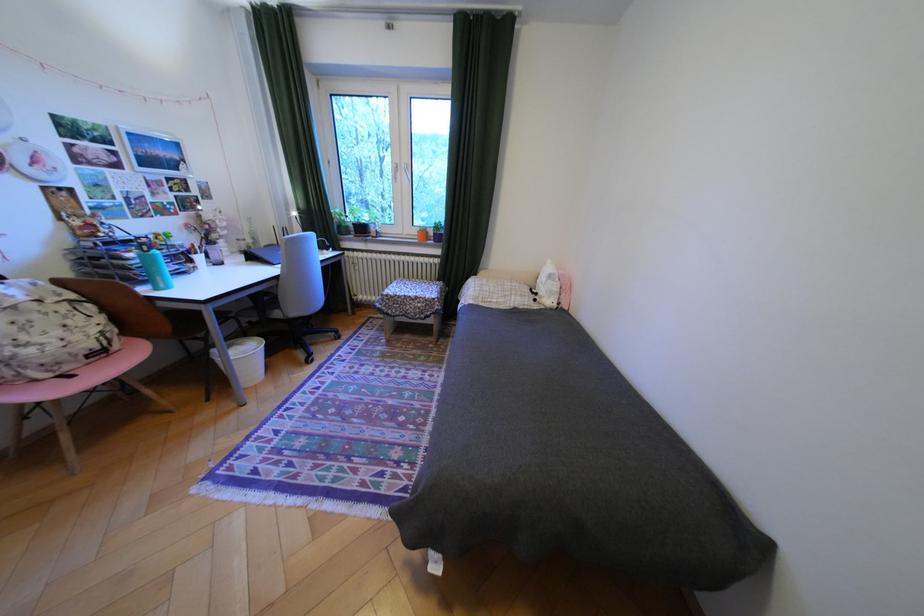
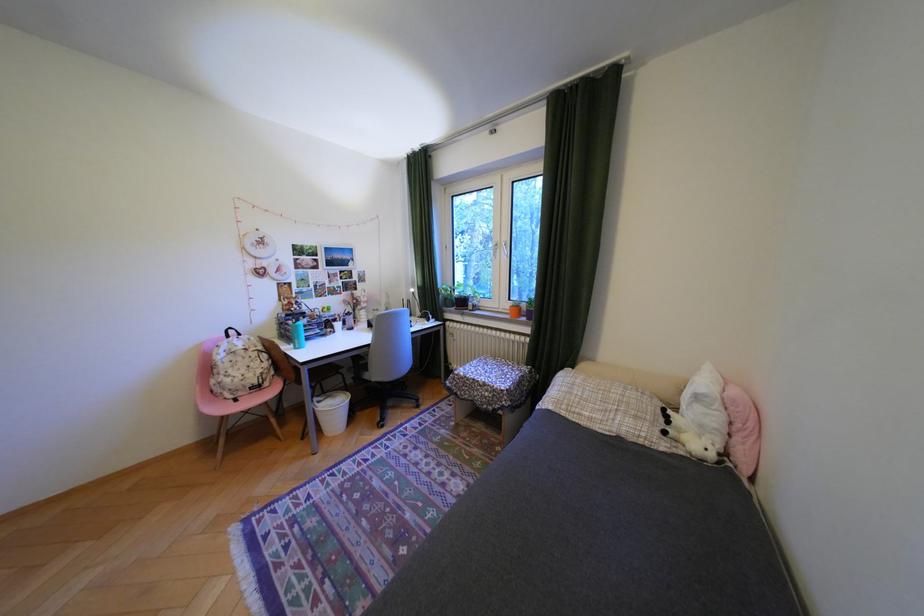
Where in the second image is the point corresponding to [42,351] from the first image?

(239, 379)